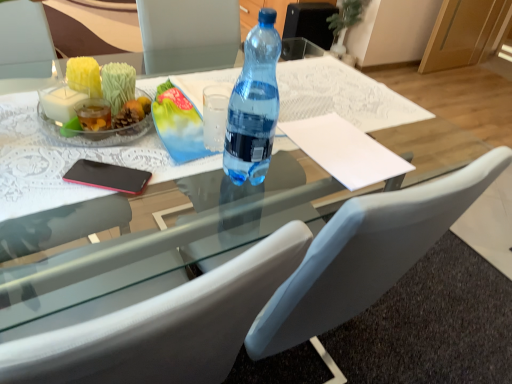
Question: In terms of size, does white leather chair at center appear bigger or smaller than transparent glass table at center?

Choices:
 (A) big
 (B) small

Answer: (A)

Question: Visually, is white leather chair at center positioned to the left or to the right of transparent glass table at center?

Choices:
 (A) right
 (B) left

Answer: (A)

Question: Which is farther from the white paper at center?

Choices:
 (A) white leather chair at center
 (B) transparent plastic bottle at center
 (C) transparent glass table at center

Answer: (A)

Question: Based on their relative distances, which object is farther from the white paper at center?

Choices:
 (A) white leather chair at center
 (B) transparent glass table at center
 (C) transparent plastic bottle at center

Answer: (A)